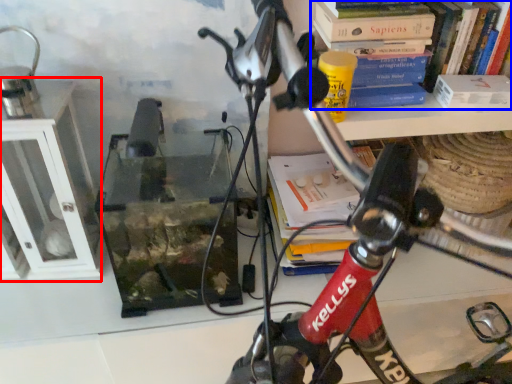
Question: Which point is further to the camera, shelf (highlighted by a red box) or book (highlighted by a blue box)?

Choices:
 (A) shelf
 (B) book

Answer: (B)